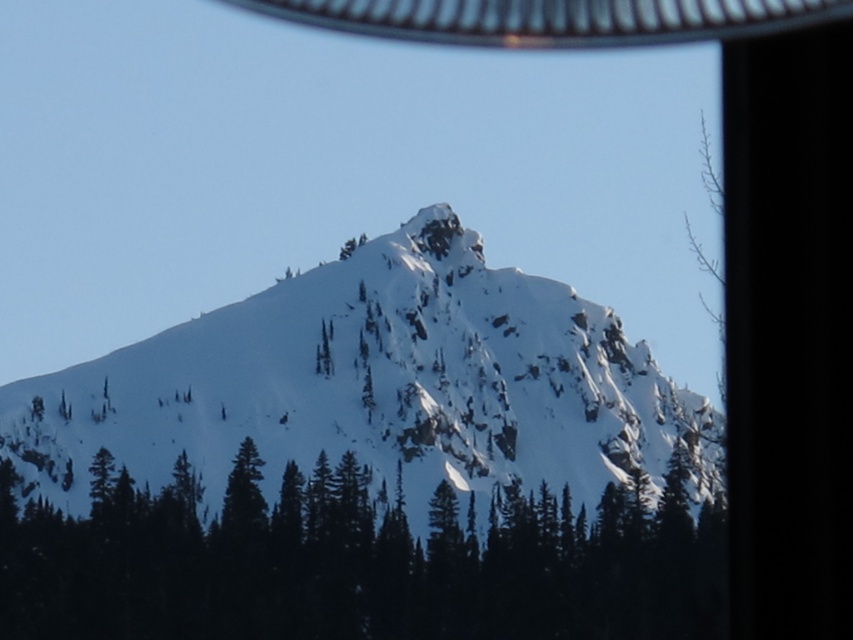
You are standing at the point marked by the coordinate point at point (375, 385). Looking around, you see the white snow covered mountain at center. Which direction should you go to reach the base of the white snow covered mountain at center?

The point at (375, 385) is the location of the white snow covered mountain at center, so you are already at the mountain. Therefore, you don not need to go anywhere else.